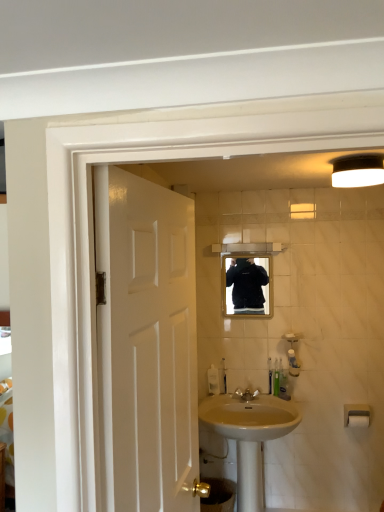
Question: From their relative heights in the image, would you say polished brass faucet at sink center is taller or shorter than matte black mirror at center?

Choices:
 (A) short
 (B) tall

Answer: (A)

Question: Is polished brass faucet at sink center in front of or behind matte black mirror at center in the image?

Choices:
 (A) front
 (B) behind

Answer: (A)

Question: Estimate the real-world distances between objects in this image. Which object is closer to the white plastic toothbrush at lower center, which is the first toiletry from left to right?

Choices:
 (A) green plastic toothbrush at center, acting as the 2th toiletry starting from the left
 (B) beige ceramic sink at center
 (C) translucent plastic toothbrush at lower right, arranged as the 4th toiletry when viewed from the left
 (D) white matte light fixture at upper right
 (E) translucent plastic soap dispenser at sink

Answer: (E)

Question: Considering the real-world distances, which object is closest to the white glossy door at left?

Choices:
 (A) translucent plastic soap dispenser at sink
 (B) white matte light fixture at upper right
 (C) matte black mirror at center
 (D) translucent plastic toothbrush at lower right, arranged as the 4th toiletry when viewed from the left
 (E) beige ceramic sink at center

Answer: (B)